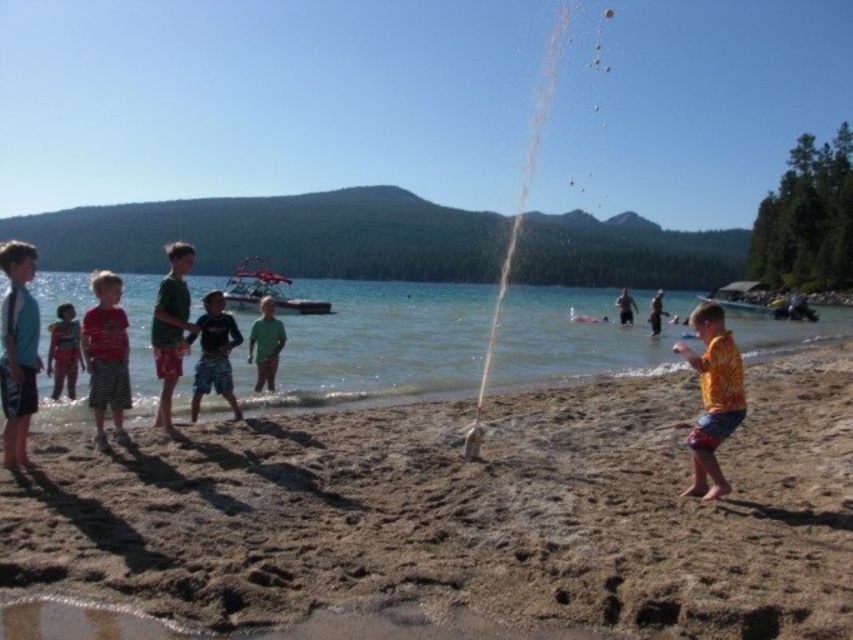
Question: Which point is farther from the camera taking this photo?

Choices:
 (A) (105, 289)
 (B) (345, 352)
 (C) (218, 330)

Answer: (B)

Question: Is yellow tie-dye shirt at center thinner than dark blue shorts at center?

Choices:
 (A) no
 (B) yes

Answer: (A)

Question: Does matte green shorts at left appear under green matte shirt at center?

Choices:
 (A) yes
 (B) no

Answer: (A)

Question: Which point is farther to the camera?

Choices:
 (A) (619, 300)
 (B) (416, 310)
 (C) (265, 301)

Answer: (B)

Question: Does yellow tie-dye shirt at center come behind green matte shirt at center?

Choices:
 (A) yes
 (B) no

Answer: (B)

Question: Which object is the farthest from the clear water at center?

Choices:
 (A) blue t-shirt at left
 (B) matte green shorts at left
 (C) dark blue shorts at center
 (D) green cotton shorts at center

Answer: (A)